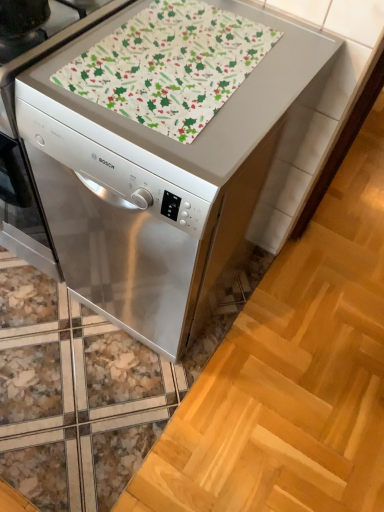
Question: Can you confirm if patterned fabric at center is thinner than satin silver dishwasher at center?

Choices:
 (A) yes
 (B) no

Answer: (A)

Question: Is patterned fabric at center taller than satin silver dishwasher at center?

Choices:
 (A) no
 (B) yes

Answer: (A)

Question: From the image's perspective, would you say patterned fabric at center is shown under satin silver dishwasher at center?

Choices:
 (A) yes
 (B) no

Answer: (B)

Question: From the image's perspective, is patterned fabric at center located above satin silver dishwasher at center?

Choices:
 (A) no
 (B) yes

Answer: (B)

Question: Is patterned fabric at center smaller than satin silver dishwasher at center?

Choices:
 (A) yes
 (B) no

Answer: (A)

Question: Is satin silver dishwasher at center completely or partially inside patterned fabric at center?

Choices:
 (A) no
 (B) yes

Answer: (A)

Question: Is satin silver dishwasher at center closer to camera compared to patterned fabric at center?

Choices:
 (A) no
 (B) yes

Answer: (B)

Question: Is satin silver dishwasher at center aimed at patterned fabric at center?

Choices:
 (A) no
 (B) yes

Answer: (A)

Question: Does satin silver dishwasher at center touch patterned fabric at center?

Choices:
 (A) no
 (B) yes

Answer: (A)

Question: From a real-world perspective, is satin silver dishwasher at center under patterned fabric at center?

Choices:
 (A) yes
 (B) no

Answer: (A)

Question: Is satin silver dishwasher at center to the left of patterned fabric at center from the viewer's perspective?

Choices:
 (A) yes
 (B) no

Answer: (A)

Question: Considering the relative positions of satin silver dishwasher at center and patterned fabric at center in the image provided, is satin silver dishwasher at center to the right of patterned fabric at center from the viewer's perspective?

Choices:
 (A) no
 (B) yes

Answer: (A)

Question: Considering the positions of point (221, 199) and point (238, 55), is point (221, 199) closer or farther from the camera than point (238, 55)?

Choices:
 (A) closer
 (B) farther

Answer: (A)